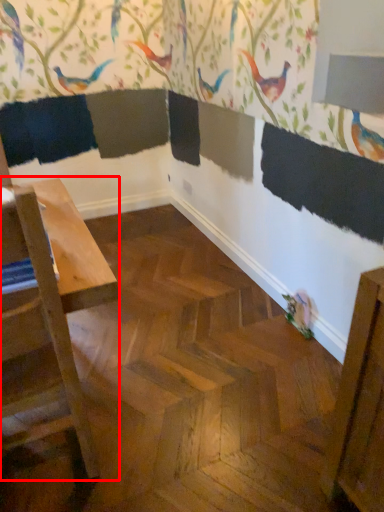
Question: Considering the relative positions of table (annotated by the red box) and bird in the image provided, where is table (annotated by the red box) located with respect to the staircase?

Choices:
 (A) left
 (B) right

Answer: (A)